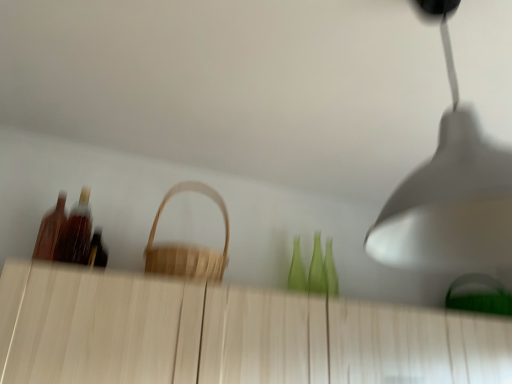
Question: Looking at their shapes, would you say shiny brown bottle at left, the first bottle from the right, is wider or thinner than wooden bottle at left, the second bottle from the right?

Choices:
 (A) wide
 (B) thin

Answer: (A)

Question: From the image's perspective, is shiny brown bottle at left, the first bottle from the right, above or below wooden bottle at left, acting as the first bottle starting from the left?

Choices:
 (A) above
 (B) below

Answer: (B)

Question: Which of these objects is positioned farthest from the white matte lampshade at upper right?

Choices:
 (A) shiny brown bottle at left, the first bottle from the right
 (B) wooden bottle at left, the second bottle from the right
 (C) light wood dresser at center
 (D) natural wood basket at center

Answer: (B)

Question: Which object is the closest to the light wood dresser at center?

Choices:
 (A) wooden bottle at left, the second bottle from the right
 (B) white matte lampshade at upper right
 (C) shiny brown bottle at left, acting as the second bottle starting from the left
 (D) natural wood basket at center

Answer: (D)